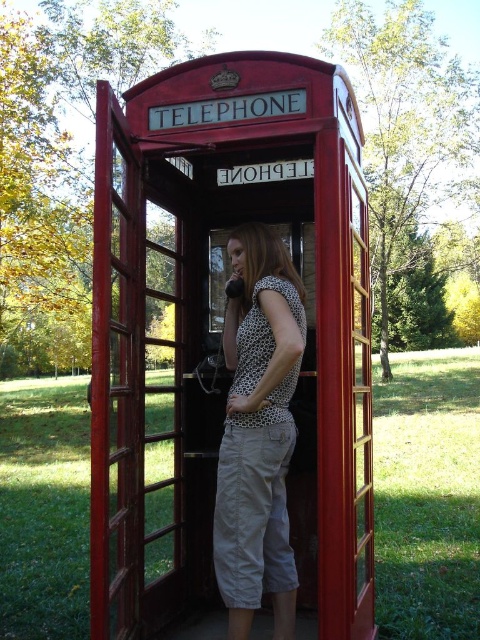
You are a photographer trying to capture a photo of the matte red telephone booth at center and the polka dot fabric shirt at center. From your current position, which object is located to the left?

The matte red telephone booth at center is positioned on the left side of the polka dot fabric shirt at center, so it is located to the left.

You are a delivery person trying to deliver a package to the matte red telephone booth at center. There is a polka dot fabric shirt at center blocking the entrance. Can you tell me if the booth is wide enough for you to walk around the shirt and enter?

The matte red telephone booth at center might be wider than the polka dot fabric shirt at center, so there is a possibility that you can walk around the shirt and enter the booth.

You are a photographer planning to take a full body portrait of the person wearing the polka dot fabric shirt at center. The matte red telephone booth at center is in the background. Will the telephone booth appear larger than the person in the photo?

The matte red telephone booth at center has a larger size compared to the polka dot fabric shirt at center, so yes, the telephone booth will appear larger than the person in the photo.